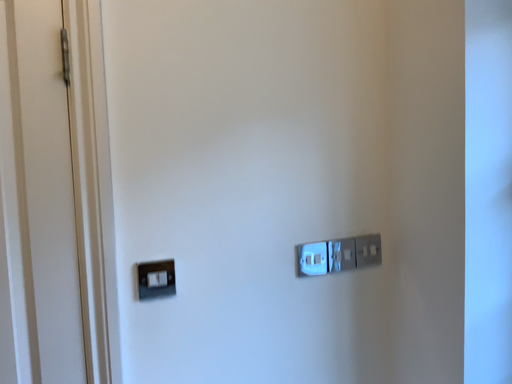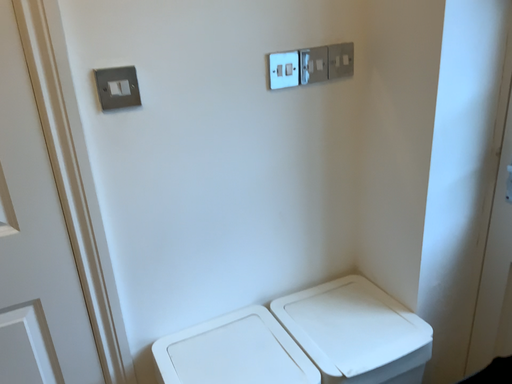
Question: How did the camera likely rotate when shooting the video?

Choices:
 (A) rotated downward
 (B) rotated upward

Answer: (A)